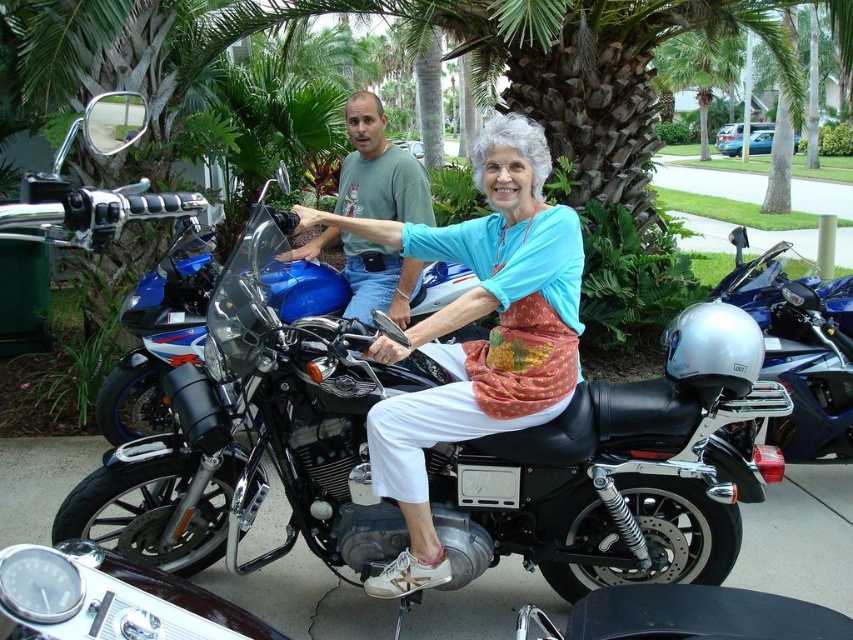
Who is more forward, (548, 490) or (775, 259)?

Point (548, 490)

This screenshot has width=853, height=640. What do you see at coordinates (253, 438) in the screenshot?
I see `black matte motorcycle at center` at bounding box center [253, 438].

Is point (590, 573) behind point (808, 346)?

No, (590, 573) is in front of (808, 346).

This screenshot has width=853, height=640. I want to click on black matte motorcycle at center, so click(x=253, y=438).

Does point (556, 333) come closer to viewer compared to point (816, 429)?

That is True.

What do you see at coordinates (479, 339) in the screenshot?
I see `matte blue helmet at upper center` at bounding box center [479, 339].

Identify the location of matte blue helmet at upper center. (479, 339).

Who is positioned more to the right, black matte motorcycle at center or matte blue helmet at center?

From the viewer's perspective, black matte motorcycle at center appears more on the right side.

At what (x,y) coordinates should I click in order to perform the action: click on black matte motorcycle at center. Please return your answer as a coordinate pair (x, y). The width and height of the screenshot is (853, 640). Looking at the image, I should click on (253, 438).